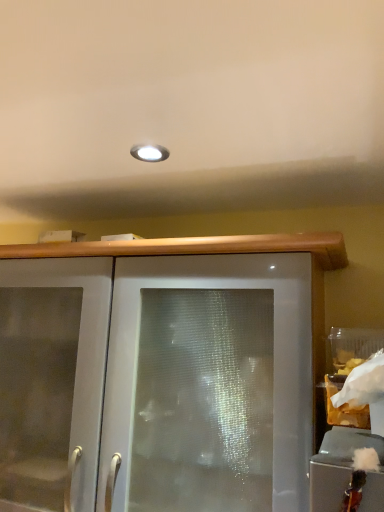
Question: Can you confirm if frosted glass cabinet at lower right, arranged as the 1th cabinetry when viewed from the top, is smaller than white paper bag at right?

Choices:
 (A) yes
 (B) no

Answer: (A)

Question: Does frosted glass cabinet at lower right, the second cabinetry from the bottom, have a greater width compared to white paper bag at right?

Choices:
 (A) no
 (B) yes

Answer: (A)

Question: Is frosted glass cabinet at lower right, arranged as the 1th cabinetry when viewed from the top, oriented away from white paper bag at right?

Choices:
 (A) no
 (B) yes

Answer: (B)

Question: From the image's perspective, is frosted glass cabinet at lower right, arranged as the 1th cabinetry when viewed from the top, located beneath white paper bag at right?

Choices:
 (A) no
 (B) yes

Answer: (B)

Question: From a real-world perspective, is frosted glass cabinet at lower right, arranged as the 1th cabinetry when viewed from the top, physically below white paper bag at right?

Choices:
 (A) no
 (B) yes

Answer: (B)

Question: Relative to frosted glass cabinet at lower right, the second cabinetry from the bottom, is satin white cabinet at center, placed as the second cabinetry when sorted from front to back, in front or behind?

Choices:
 (A) front
 (B) behind

Answer: (B)

Question: In terms of size, does satin white cabinet at center, which appears as the 1th cabinetry when ordered from the bottom, appear bigger or smaller than frosted glass cabinet at lower right, placed as the 2th cabinetry when sorted from left to right?

Choices:
 (A) small
 (B) big

Answer: (B)

Question: From the image's perspective, is satin white cabinet at center, arranged as the first cabinetry when viewed from the left, positioned above or below frosted glass cabinet at lower right, which is the second cabinetry in back-to-front order?

Choices:
 (A) above
 (B) below

Answer: (B)

Question: From a real-world perspective, relative to frosted glass cabinet at lower right, acting as the first cabinetry starting from the front, is satin white cabinet at center, positioned as the first cabinetry in back-to-front order, vertically above or below?

Choices:
 (A) above
 (B) below

Answer: (B)

Question: From a real-world perspective, is white paper bag at right above or below satin white cabinet at center, positioned as the first cabinetry in back-to-front order?

Choices:
 (A) below
 (B) above

Answer: (B)

Question: Considering the positions of white paper bag at right and satin white cabinet at center, positioned as the first cabinetry in back-to-front order, in the image, is white paper bag at right wider or thinner than satin white cabinet at center, positioned as the first cabinetry in back-to-front order,?

Choices:
 (A) wide
 (B) thin

Answer: (B)

Question: Considering the positions of point (355, 402) and point (258, 391), is point (355, 402) closer or farther from the camera than point (258, 391)?

Choices:
 (A) closer
 (B) farther

Answer: (A)

Question: Based on their positions, is white paper bag at right located to the left or right of satin white cabinet at center, positioned as the first cabinetry in back-to-front order?

Choices:
 (A) right
 (B) left

Answer: (A)

Question: Is white paper bag at right bigger or smaller than frosted glass cabinet at lower right, acting as the first cabinetry starting from the front?

Choices:
 (A) big
 (B) small

Answer: (A)

Question: From the image's perspective, is white paper bag at right positioned above or below frosted glass cabinet at lower right, which is the second cabinetry in back-to-front order?

Choices:
 (A) above
 (B) below

Answer: (A)